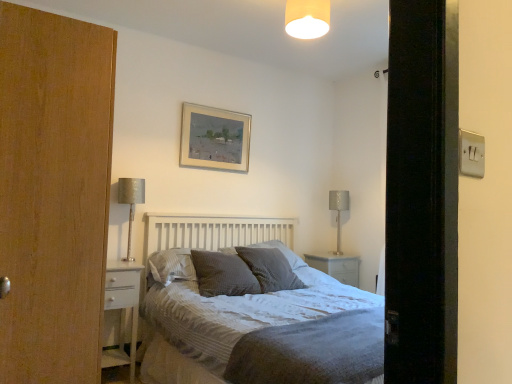
Find the location of a particular element. The height and width of the screenshot is (384, 512). gold metallic picture frame at upper center is located at coordinates (215, 138).

Identify the location of dark grey textured pillow at center, arranged as the 1th pillow when viewed from the left. (170, 266).

Describe the element at coordinates (223, 274) in the screenshot. I see `textured grey pillow at center, marked as the 3th pillow in a right-to-left arrangement` at that location.

This screenshot has height=384, width=512. What are the coordinates of `satin silver table lamp at right, which is the 2th table lamp from front to back` in the screenshot? It's located at (339, 212).

The width and height of the screenshot is (512, 384). Find the location of `silver textured table lamp at left, placed as the 1th table lamp when sorted from left to right`. silver textured table lamp at left, placed as the 1th table lamp when sorted from left to right is located at coordinates (130, 203).

From the textured grey pillow at center, which is counted as the third pillow, starting from the left, count the 1st pillow to the left and point to it. Please provide its 2D coordinates.

[(223, 274)]

In terms of size, does textured grey pillow at center, the 2th pillow when ordered from left to right, appear bigger or smaller than textured grey pillow at center, which is the second pillow from right to left?

Considering their sizes, textured grey pillow at center, the 2th pillow when ordered from left to right, takes up less space than textured grey pillow at center, which is the second pillow from right to left.

From a real-world perspective, is textured grey pillow at center, marked as the 3th pillow in a right-to-left arrangement, located higher than textured grey pillow at center, which is counted as the third pillow, starting from the left?

No, from a real-world perspective, textured grey pillow at center, marked as the 3th pillow in a right-to-left arrangement, is not over textured grey pillow at center, which is counted as the third pillow, starting from the left

How many degrees apart are the facing directions of textured grey pillow at center, the 2th pillow when ordered from left to right, and textured grey pillow at center, which is the second pillow from right to left?

There is a 11.9-degree angle between the facing directions of textured grey pillow at center, the 2th pillow when ordered from left to right, and textured grey pillow at center, which is the second pillow from right to left.

Is white wood bed at center turned away from textured grey pillow at center, marked as the 3th pillow in a right-to-left arrangement?

Absolutely, white wood bed at center is directed away from textured grey pillow at center, marked as the 3th pillow in a right-to-left arrangement.

Which is in front, point (350, 373) or point (249, 287)?

Positioned in front is point (350, 373).

From the image's perspective, is white wood bed at center beneath textured grey pillow at center, marked as the 3th pillow in a right-to-left arrangement?

Indeed, from the image's perspective, white wood bed at center is shown beneath textured grey pillow at center, marked as the 3th pillow in a right-to-left arrangement.

Can we say white wood bed at center lies outside textured grey pillow at center, marked as the 3th pillow in a right-to-left arrangement?

Yes.

Which of these two, matte beige lampshade at upper center or textured gray pillow at center, arranged as the 4th pillow when viewed from the left, stands shorter?

matte beige lampshade at upper center is shorter.

Which is more to the left, matte beige lampshade at upper center or textured gray pillow at center, the 1th pillow when ordered from right to left?

textured gray pillow at center, the 1th pillow when ordered from right to left, is more to the left.

Considering the relative sizes of matte beige lampshade at upper center and textured gray pillow at center, the 1th pillow when ordered from right to left, in the image provided, is matte beige lampshade at upper center bigger than textured gray pillow at center, the 1th pillow when ordered from right to left,?

No.

From a real-world perspective, is matte beige lampshade at upper center beneath textured gray pillow at center, arranged as the 4th pillow when viewed from the left?

No, from a real-world perspective, matte beige lampshade at upper center is not beneath textured gray pillow at center, arranged as the 4th pillow when viewed from the left.

Consider the image. Between silver textured table lamp at left, the second table lamp viewed from the right, and white wood bed at center, which one has larger width?

With larger width is white wood bed at center.

How different are the orientations of silver textured table lamp at left, the 1th table lamp viewed from the front, and white wood bed at center in degrees?

The angle between the facing direction of silver textured table lamp at left, the 1th table lamp viewed from the front, and the facing direction of white wood bed at center is 0.186 degrees.

Locate an element on the screen. The image size is (512, 384). bed in front of the silver textured table lamp at left, the 1th table lamp viewed from the front is located at coordinates (266, 332).

From the image's perspective, which one is positioned higher, silver textured table lamp at left, which ranks as the second table lamp in back-to-front order, or white wood bed at center?

From the image's view, silver textured table lamp at left, which ranks as the second table lamp in back-to-front order, is above.

Considering the positions of objects matte beige lampshade at upper center and white glossy nightstand at lower left in the image provided, who is in front, matte beige lampshade at upper center or white glossy nightstand at lower left?

matte beige lampshade at upper center.

Would you say matte beige lampshade at upper center is to the left or to the right of white glossy nightstand at lower left in the picture?

matte beige lampshade at upper center is positioned on white glossy nightstand at lower left's right side.

Which of these two, textured grey pillow at center, which is counted as the third pillow, starting from the left, or white glossy nightstand at lower left, is smaller?

With smaller size is textured grey pillow at center, which is counted as the third pillow, starting from the left.

Which pillow is the 4th one when counting from the back of the white glossy nightstand at lower left? Please provide its 2D coordinates.

[(282, 252)]

Considering the relative sizes of textured grey pillow at center, which is counted as the third pillow, starting from the left, and white glossy nightstand at lower left in the image provided, is textured grey pillow at center, which is counted as the third pillow, starting from the left, taller than white glossy nightstand at lower left?

No, textured grey pillow at center, which is counted as the third pillow, starting from the left, is not taller than white glossy nightstand at lower left.

From the image's perspective, which is below, textured grey pillow at center, which is the second pillow from right to left, or white glossy nightstand at lower left?

white glossy nightstand at lower left, from the image's perspective.

Is satin silver table lamp at right, which is the 2th table lamp from front to back, spatially inside textured grey pillow at center, the 2th pillow when ordered from left to right, or outside of it?

satin silver table lamp at right, which is the 2th table lamp from front to back, exists outside the volume of textured grey pillow at center, the 2th pillow when ordered from left to right.

Does satin silver table lamp at right, acting as the first table lamp starting from the right, lie in front of textured grey pillow at center, the 2th pillow when ordered from left to right?

No, it is not.

Does point (338, 251) lie in front of point (244, 271)?

No, it is behind (244, 271).

Starting from the textured grey pillow at center, the 2th pillow when ordered from left to right, which pillow is the 1st one to the right? Please provide its 2D coordinates.

[(282, 252)]

Identify the location of bed below the textured grey pillow at center, marked as the 3th pillow in a right-to-left arrangement (from the image's perspective). The width and height of the screenshot is (512, 384). [x=266, y=332].

In the scene shown: Based on their spatial positions, is silver textured table lamp at left, the 1th table lamp viewed from the front, or dark grey textured pillow at center, arranged as the 1th pillow when viewed from the left, closer to white wood bed at center?

dark grey textured pillow at center, arranged as the 1th pillow when viewed from the left, is positioned closer to the anchor white wood bed at center.

Based on their spatial positions, is silver textured table lamp at left, the second table lamp viewed from the right, or satin silver table lamp at right, acting as the first table lamp starting from the right, further from gold metallic picture frame at upper center?

The object further to gold metallic picture frame at upper center is satin silver table lamp at right, acting as the first table lamp starting from the right.

Based on their spatial positions, is silver textured table lamp at left, which ranks as the second table lamp in back-to-front order, or gold metallic picture frame at upper center further from textured gray pillow at center, the 1th pillow when ordered from right to left?

The object further to textured gray pillow at center, the 1th pillow when ordered from right to left, is gold metallic picture frame at upper center.

Considering their positions, is satin silver table lamp at right, marked as the 1th table lamp in a back-to-front arrangement, positioned further to white wood bed at center than silver textured table lamp at left, the second table lamp viewed from the right?

Among the two, satin silver table lamp at right, marked as the 1th table lamp in a back-to-front arrangement, is located further to white wood bed at center.

Looking at the image, which one is located further to silver textured table lamp at left, the second table lamp viewed from the right, satin silver table lamp at right, which is the 2th table lamp from front to back, or textured grey pillow at center, marked as the 3th pillow in a right-to-left arrangement?

Based on the image, satin silver table lamp at right, which is the 2th table lamp from front to back, appears to be further to silver textured table lamp at left, the second table lamp viewed from the right.

Estimate the real-world distances between objects in this image. Which object is closer to white glossy nightstand at lower left, dark grey textured pillow at center, arranged as the 1th pillow when viewed from the left, or white wood bed at center?

Among the two, dark grey textured pillow at center, arranged as the 1th pillow when viewed from the left, is located nearer to white glossy nightstand at lower left.

From the image, which object appears to be nearer to dark grey textured pillow at center, which is counted as the 4th pillow, starting from the right, silver textured table lamp at left, which ranks as the second table lamp in back-to-front order, or white wood bed at center?

silver textured table lamp at left, which ranks as the second table lamp in back-to-front order, is closer to dark grey textured pillow at center, which is counted as the 4th pillow, starting from the right.

Estimate the real-world distances between objects in this image. Which object is closer to white wood bed at center, satin silver table lamp at right, acting as the first table lamp starting from the right, or dark grey textured pillow at center, arranged as the 1th pillow when viewed from the left?

Among the two, dark grey textured pillow at center, arranged as the 1th pillow when viewed from the left, is located nearer to white wood bed at center.

The image size is (512, 384). Find the location of `nightstand positioned between white wood bed at center and satin silver table lamp at right, marked as the 1th table lamp in a back-to-front arrangement, from near to far`. nightstand positioned between white wood bed at center and satin silver table lamp at right, marked as the 1th table lamp in a back-to-front arrangement, from near to far is located at coordinates (122, 309).

You are a GUI agent. You are given a task and a screenshot of the screen. Output one action in this format:
    pyautogui.click(x=<x>, y=<y>)
    Task: Click on the table lamp located between white glossy nightstand at lower left and satin silver table lamp at right, acting as the 2th table lamp starting from the left, in the left-right direction
    The image size is (512, 384).
    Given the screenshot: What is the action you would take?
    pyautogui.click(x=130, y=203)

Find the location of `picture frame between dark grey textured pillow at center, arranged as the 1th pillow when viewed from the left, and satin silver table lamp at right, acting as the 2th table lamp starting from the left, in the horizontal direction`. picture frame between dark grey textured pillow at center, arranged as the 1th pillow when viewed from the left, and satin silver table lamp at right, acting as the 2th table lamp starting from the left, in the horizontal direction is located at coordinates (215, 138).

Image resolution: width=512 pixels, height=384 pixels. Identify the location of pillow situated between dark grey textured pillow at center, arranged as the 1th pillow when viewed from the left, and textured grey pillow at center, which is counted as the third pillow, starting from the left, from left to right. (223, 274).